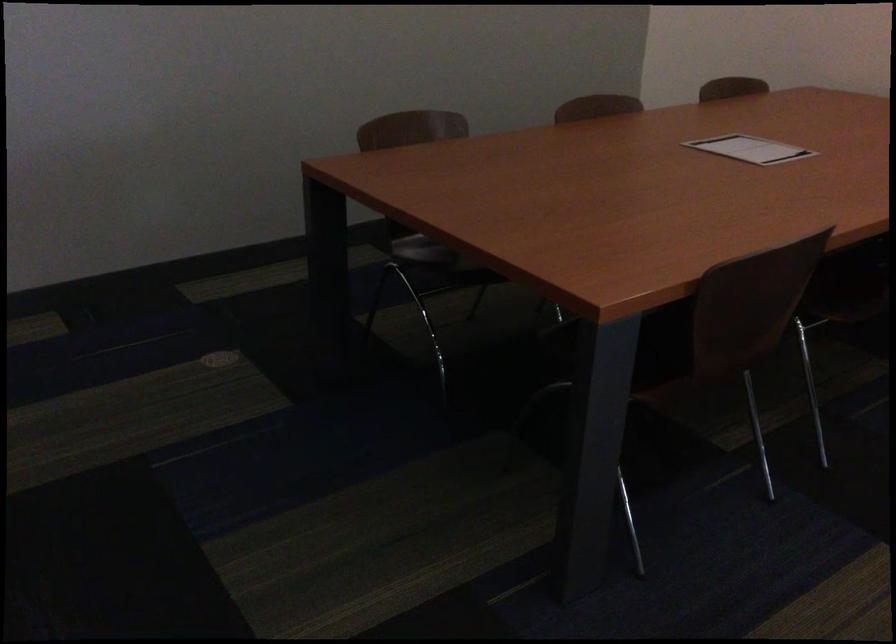
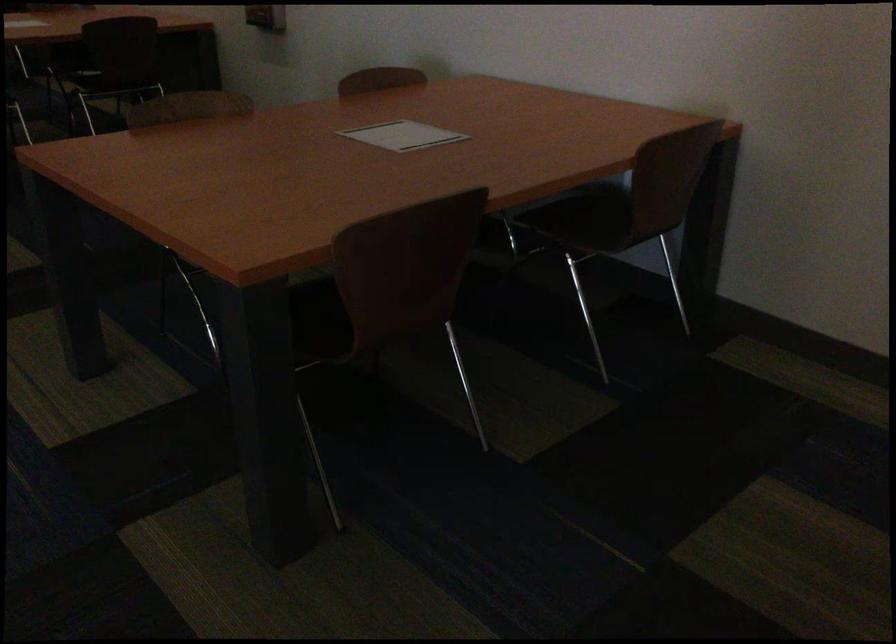
The images are taken continuously from a first-person perspective. In which direction is your viewpoint rotating?

The camera rotated toward left-down.